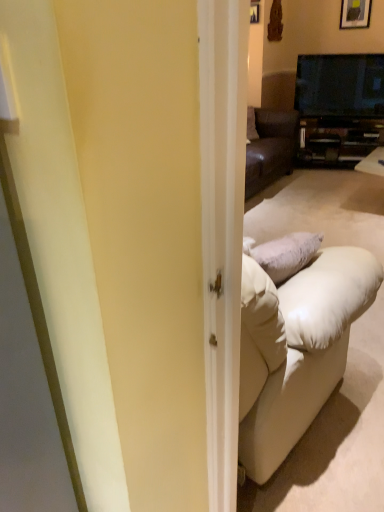
Question: Is matte black cabinet at center at the right side of wooden framed picture at upper right?

Choices:
 (A) no
 (B) yes

Answer: (A)

Question: Considering the relative positions of matte black cabinet at center and wooden framed picture at upper right in the image provided, is matte black cabinet at center to the left of wooden framed picture at upper right from the viewer's perspective?

Choices:
 (A) yes
 (B) no

Answer: (A)

Question: Are matte black cabinet at center and wooden framed picture at upper right beside each other?

Choices:
 (A) no
 (B) yes

Answer: (A)

Question: Does matte black cabinet at center have a lesser width compared to wooden framed picture at upper right?

Choices:
 (A) no
 (B) yes

Answer: (A)

Question: Is the depth of matte black cabinet at center greater than that of wooden framed picture at upper right?

Choices:
 (A) no
 (B) yes

Answer: (B)

Question: Is matte black cabinet at center not inside wooden framed picture at upper right?

Choices:
 (A) no
 (B) yes

Answer: (B)

Question: Can you confirm if black glossy tv at upper right is wider than wooden framed picture at upper right?

Choices:
 (A) no
 (B) yes

Answer: (B)

Question: Is black glossy tv at upper right completely or partially outside of wooden framed picture at upper right?

Choices:
 (A) no
 (B) yes

Answer: (B)

Question: Is black glossy tv at upper right behind wooden framed picture at upper right?

Choices:
 (A) no
 (B) yes

Answer: (A)

Question: Is black glossy tv at upper right thinner than wooden framed picture at upper right?

Choices:
 (A) yes
 (B) no

Answer: (B)

Question: From a real-world perspective, is black glossy tv at upper right below wooden framed picture at upper right?

Choices:
 (A) yes
 (B) no

Answer: (A)

Question: Considering the relative sizes of black glossy tv at upper right and wooden framed picture at upper right in the image provided, is black glossy tv at upper right shorter than wooden framed picture at upper right?

Choices:
 (A) yes
 (B) no

Answer: (B)

Question: Considering the relative sizes of black glossy tv at upper right and matte black cabinet at center in the image provided, is black glossy tv at upper right taller than matte black cabinet at center?

Choices:
 (A) no
 (B) yes

Answer: (B)